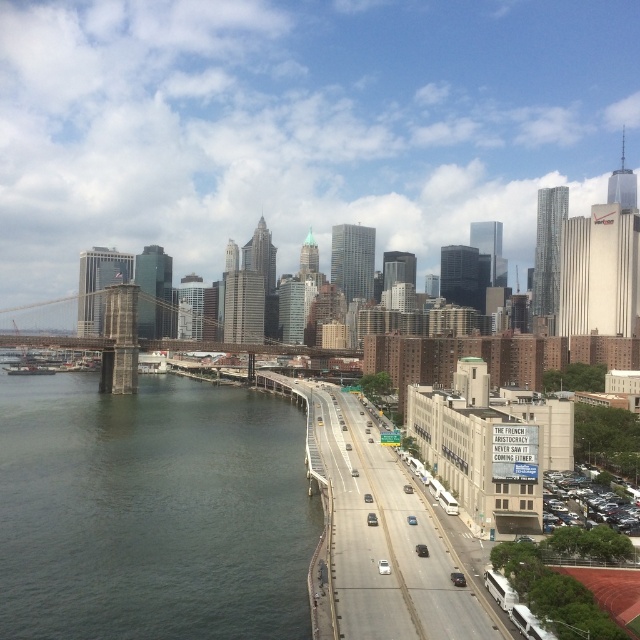
Does gray concrete river at left appear under concrete asphalt highway at center?

Yes.

Which is more to the right, gray concrete river at left or concrete asphalt highway at center?

concrete asphalt highway at center is more to the right.

Who is more distant from viewer, (x=221, y=532) or (x=488, y=621)?

Positioned behind is point (x=221, y=532).

Find the location of a particular element. The width and height of the screenshot is (640, 640). gray concrete river at left is located at coordinates (150, 509).

Is gray concrete river at left shorter than gray metallic bridge at center?

Yes.

What do you see at coordinates (150, 509) in the screenshot? The height and width of the screenshot is (640, 640). I see `gray concrete river at left` at bounding box center [150, 509].

This screenshot has width=640, height=640. I want to click on gray concrete river at left, so click(x=150, y=509).

Where is `concrete asphalt highway at center`? concrete asphalt highway at center is located at coordinates (380, 534).

Does concrete asphalt highway at center appear under gray metallic bridge at center?

Correct, concrete asphalt highway at center is located below gray metallic bridge at center.

Measure the distance between point (378, 449) and camera.

They are 118.97 meters apart.

Image resolution: width=640 pixels, height=640 pixels. Identify the location of concrete asphalt highway at center. (380, 534).